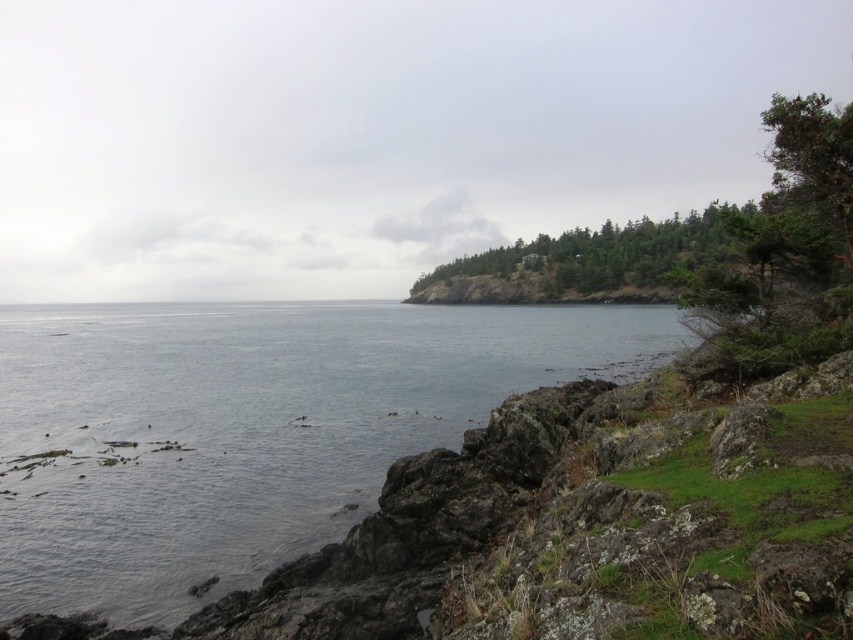
Is clear water at lower left smaller than green textured tree at upper right?

Yes, clear water at lower left is smaller than green textured tree at upper right.

Can you confirm if clear water at lower left is shorter than green textured tree at upper right?

Yes, clear water at lower left is shorter than green textured tree at upper right.

What do you see at coordinates (250, 428) in the screenshot?
I see `clear water at lower left` at bounding box center [250, 428].

Find the location of a particular element. The height and width of the screenshot is (640, 853). clear water at lower left is located at coordinates (250, 428).

Who is more forward, (53, 368) or (715, 244)?

Point (53, 368)

Based on the photo, between clear water at lower left and green leafy trees at upper right, which one has less height?

With less height is clear water at lower left.

Locate an element on the screen. The width and height of the screenshot is (853, 640). clear water at lower left is located at coordinates (250, 428).

Can you confirm if green textured tree at upper right is thinner than green leafy trees at upper right?

Yes.

Locate an element on the screen. Image resolution: width=853 pixels, height=640 pixels. green textured tree at upper right is located at coordinates (782, 253).